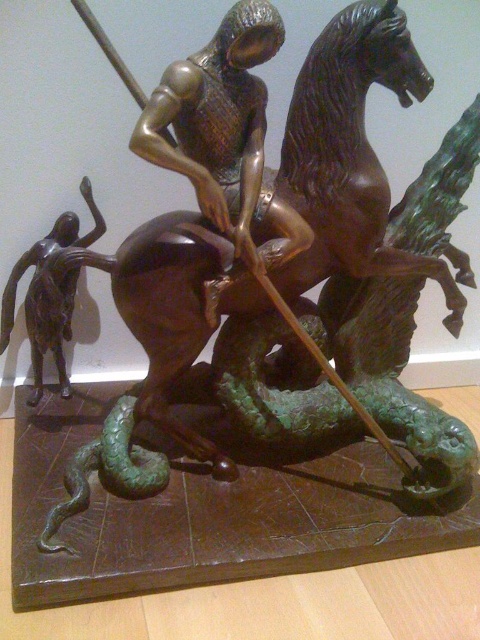
Question: Which object appears closest to the camera in this image?

Choices:
 (A) bronze figure at left
 (B) bronze figure at center

Answer: (B)

Question: Observing the image, what is the correct spatial positioning of bronze figure at center in reference to bronze figure at left?

Choices:
 (A) left
 (B) right

Answer: (B)

Question: Is bronze figure at center closer to the viewer compared to bronze figure at left?

Choices:
 (A) yes
 (B) no

Answer: (A)

Question: Does bronze figure at center have a greater width compared to bronze figure at left?

Choices:
 (A) yes
 (B) no

Answer: (A)

Question: Which point appears closest to the camera in this image?

Choices:
 (A) (264, 196)
 (B) (54, 344)

Answer: (A)